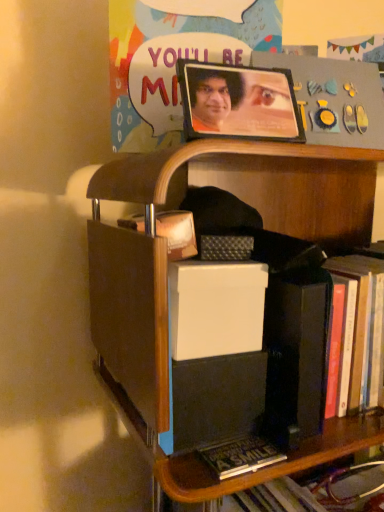
Question: From a real-world perspective, is matte plastic poster at upper center under wooden picture frame at upper center?

Choices:
 (A) no
 (B) yes

Answer: (A)

Question: Is matte plastic poster at upper center smaller than wooden picture frame at upper center?

Choices:
 (A) no
 (B) yes

Answer: (A)

Question: From a real-world perspective, is matte plastic poster at upper center positioned over wooden picture frame at upper center based on gravity?

Choices:
 (A) yes
 (B) no

Answer: (A)

Question: Can you see matte plastic poster at upper center touching wooden picture frame at upper center?

Choices:
 (A) no
 (B) yes

Answer: (B)

Question: Considering the relative sizes of matte plastic poster at upper center and wooden picture frame at upper center in the image provided, is matte plastic poster at upper center shorter than wooden picture frame at upper center?

Choices:
 (A) yes
 (B) no

Answer: (B)

Question: Is matte plastic poster at upper center behind wooden picture frame at upper center?

Choices:
 (A) yes
 (B) no

Answer: (A)

Question: Considering the relative positions of wooden shelf at center and matte plastic poster at upper center in the image provided, is wooden shelf at center in front of matte plastic poster at upper center?

Choices:
 (A) no
 (B) yes

Answer: (B)

Question: Does wooden shelf at center have a lesser height compared to matte plastic poster at upper center?

Choices:
 (A) no
 (B) yes

Answer: (A)

Question: Does wooden shelf at center have a larger size compared to matte plastic poster at upper center?

Choices:
 (A) yes
 (B) no

Answer: (A)

Question: Is wooden shelf at center directly adjacent to matte plastic poster at upper center?

Choices:
 (A) no
 (B) yes

Answer: (A)

Question: From a real-world perspective, is wooden shelf at center on matte plastic poster at upper center?

Choices:
 (A) yes
 (B) no

Answer: (B)

Question: Are wooden shelf at center and matte plastic poster at upper center located far from each other?

Choices:
 (A) no
 (B) yes

Answer: (A)

Question: Is matte plastic poster at upper center not close to wooden shelf at center?

Choices:
 (A) no
 (B) yes

Answer: (A)